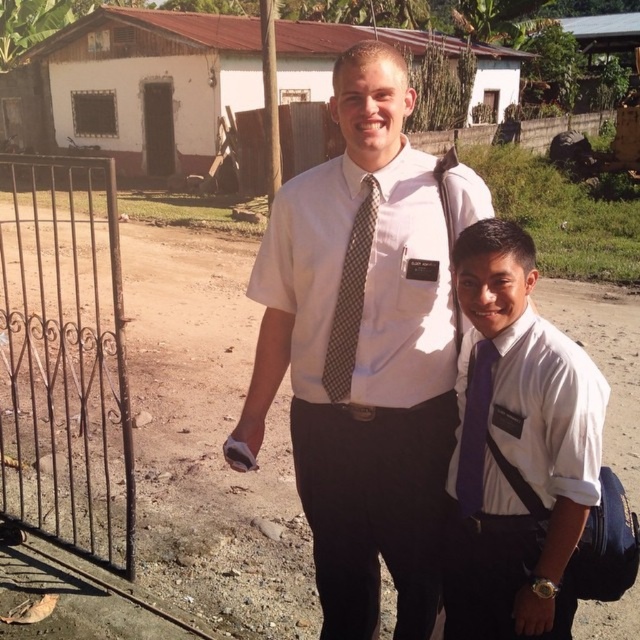
Is point (369, 230) farther from viewer compared to point (477, 465)?

Yes, it is behind point (477, 465).

Between brown dotted tie at center and purple silk tie at right, which one is positioned higher?

brown dotted tie at center is above.

Where is `brown dotted tie at center`? brown dotted tie at center is located at coordinates (349, 298).

You are a GUI agent. You are given a task and a screenshot of the screen. Output one action in this format:
    pyautogui.click(x=<x>, y=<y>)
    Task: Click on the brown dotted tie at center
    This screenshot has height=640, width=640.
    Given the screenshot: What is the action you would take?
    pyautogui.click(x=349, y=298)

Is white painted wood hut at upper center above brown dotted tie at center?

Correct, white painted wood hut at upper center is located above brown dotted tie at center.

This screenshot has width=640, height=640. Find the location of `white painted wood hut at upper center`. white painted wood hut at upper center is located at coordinates (134, 88).

Is white shirt at center bigger than brown dotted tie at center?

Yes, white shirt at center is bigger than brown dotted tie at center.

Can you confirm if white shirt at center is positioned above brown dotted tie at center?

Actually, white shirt at center is below brown dotted tie at center.

Is point (429, 484) positioned behind point (339, 381)?

Yes.

Locate an element on the screen. This screenshot has height=640, width=640. white shirt at center is located at coordinates (362, 353).